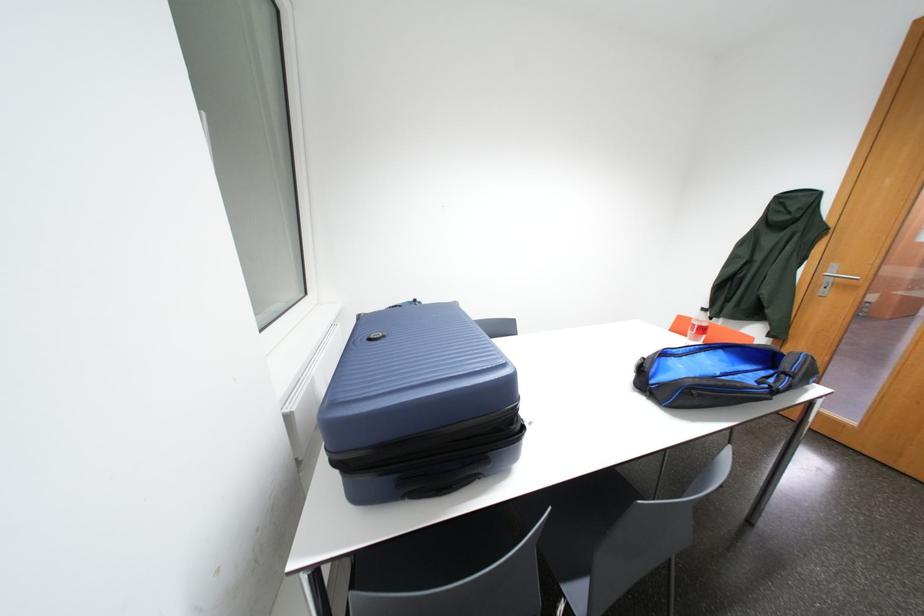
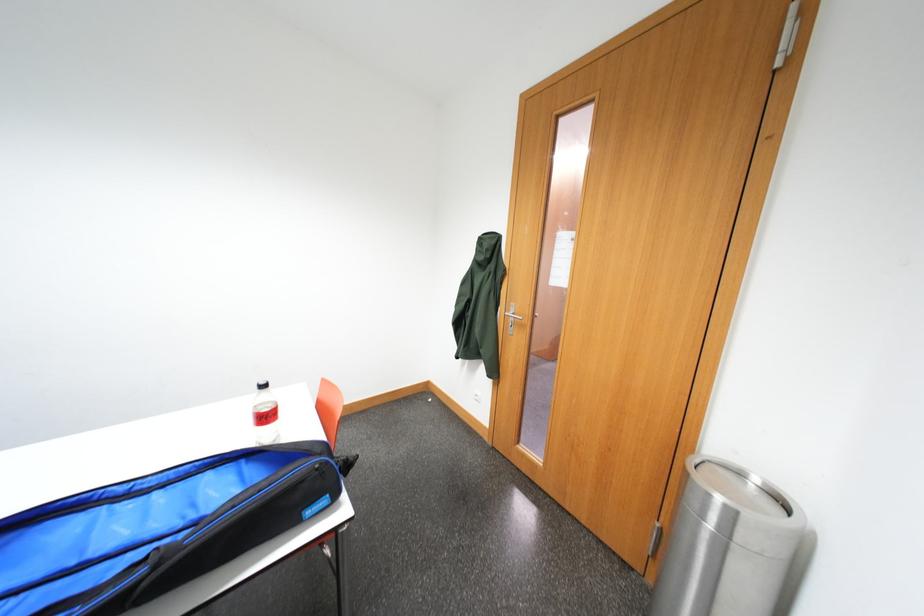
Question: The images are taken continuously from a first-person perspective. In which direction are you moving?

Choices:
 (A) Left
 (B) Right
 (C) Forward
 (D) Backward

Answer: (B)